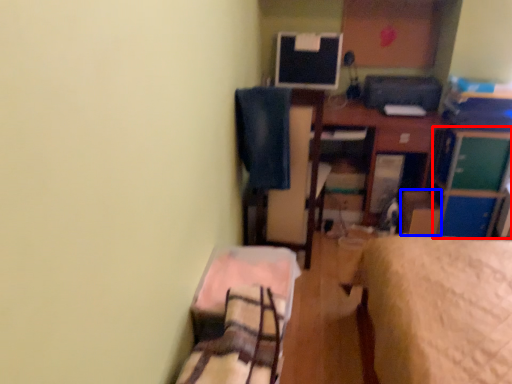
Question: Which of the following is the closest to the observer, file cabinet (highlighted by a red box) or cardboard box (highlighted by a blue box)?

Choices:
 (A) file cabinet
 (B) cardboard box

Answer: (A)